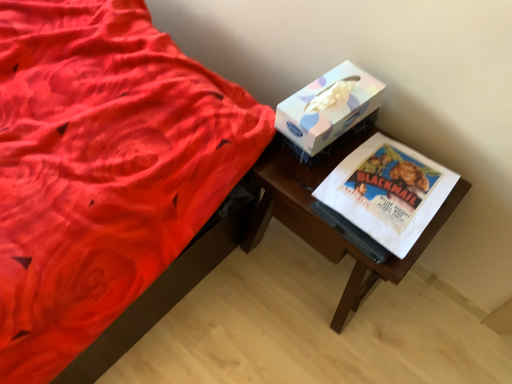
At what (x,y) coordinates should I click in order to perform the action: click on free space to the left of wooden table at right. Please return your answer as a coordinate pair (x, y). The image size is (512, 384). Looking at the image, I should click on (221, 303).